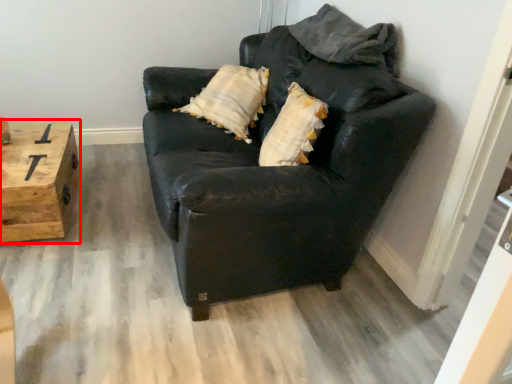
Question: From the image's perspective, what is the correct spatial relationship of table (annotated by the red box) in relation to studio couch?

Choices:
 (A) above
 (B) below

Answer: (B)